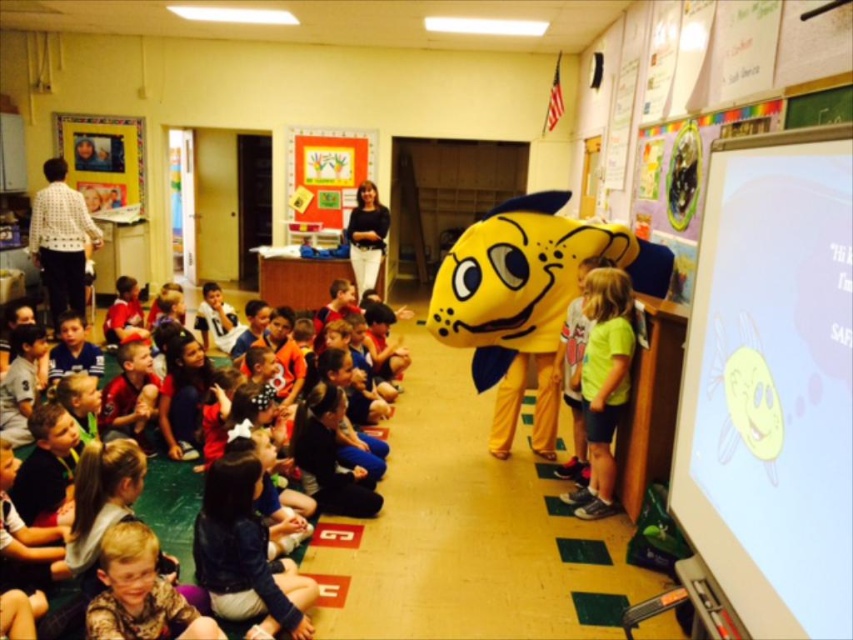
You are a photographer in the classroom and want to capture a photo of the light brown hair at lower left and the white dotted shirt at upper left. Based on their positions, which object should appear higher in the photo?

The white dotted shirt at upper left should appear higher in the photo because the light brown hair at lower left is positioned under it.

You are a student sitting in the classroom and you want to see the teacher who is standing near the white dotted shirt at upper left. However, the light brown hair at lower left is blocking your view. Which direction should you move to get a better view?

You should move to the right side because the light brown hair at lower left is in front of the white dotted shirt at upper left. Moving to the right would allow you to see around the obstruction.